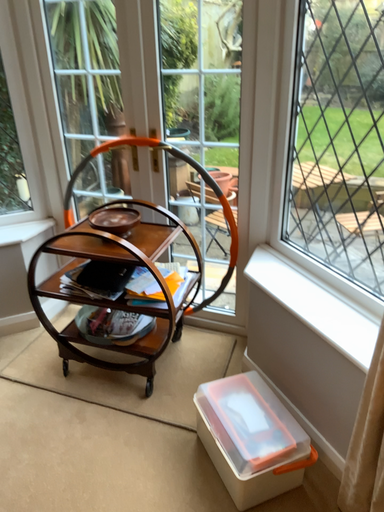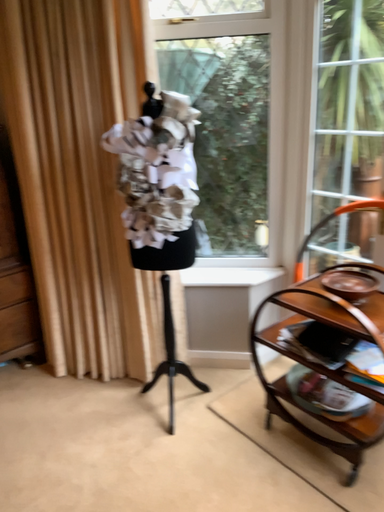
Question: How did the camera likely rotate when shooting the video?

Choices:
 (A) rotated upward
 (B) rotated downward

Answer: (A)